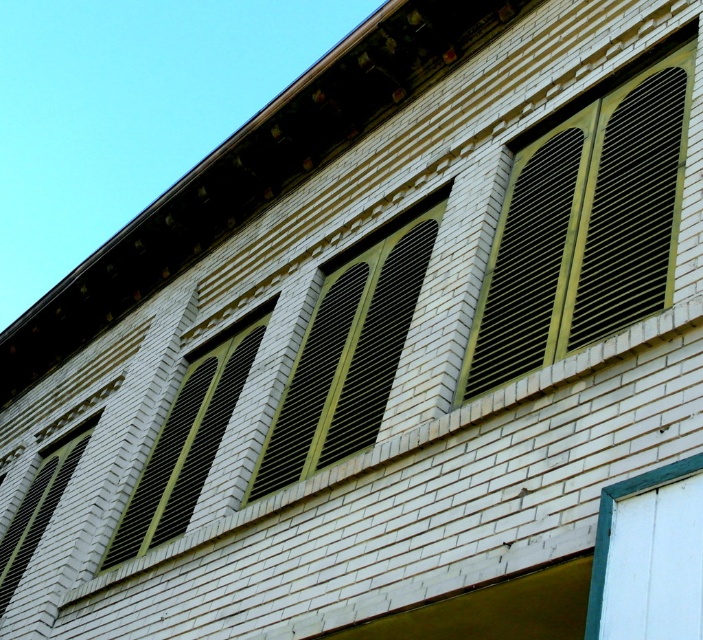
What do you see at coordinates (586, 224) in the screenshot?
I see `green matte shutters at upper right` at bounding box center [586, 224].

Is point (491, 362) closer to viewer compared to point (1, 596)?

Yes, it is.

The width and height of the screenshot is (703, 640). What are the coordinates of `green matte shutters at upper right` in the screenshot? It's located at (586, 224).

Does green matte shutters at upper right have a larger size compared to green matte shutters at center?

Yes, green matte shutters at upper right is bigger than green matte shutters at center.

Is green matte shutters at upper right wider than green matte shutters at center?

Yes, green matte shutters at upper right is wider than green matte shutters at center.

Which is in front, point (647, 125) or point (378, 369)?

Positioned in front is point (647, 125).

Where is `green matte shutters at upper right`? green matte shutters at upper right is located at coordinates (586, 224).

Can you confirm if green matte shutters at upper right is shorter than matte black shutter at center?

No, green matte shutters at upper right is not shorter than matte black shutter at center.

Where is `green matte shutters at upper right`? The height and width of the screenshot is (640, 703). green matte shutters at upper right is located at coordinates (586, 224).

Image resolution: width=703 pixels, height=640 pixels. Describe the element at coordinates (586, 224) in the screenshot. I see `green matte shutters at upper right` at that location.

Locate an element on the screen. This screenshot has height=640, width=703. green matte shutters at upper right is located at coordinates (586, 224).